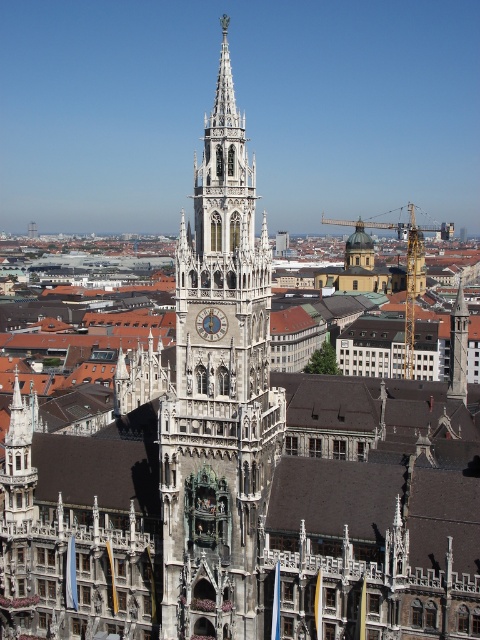
Question: Is the position of white stone clock tower at center less distant than that of matte gray clock at center?

Choices:
 (A) yes
 (B) no

Answer: (A)

Question: Does white stone clock tower at center have a smaller size compared to matte gray clock at center?

Choices:
 (A) no
 (B) yes

Answer: (A)

Question: Can you confirm if white stone clock tower at center is thinner than matte gray clock at center?

Choices:
 (A) no
 (B) yes

Answer: (A)